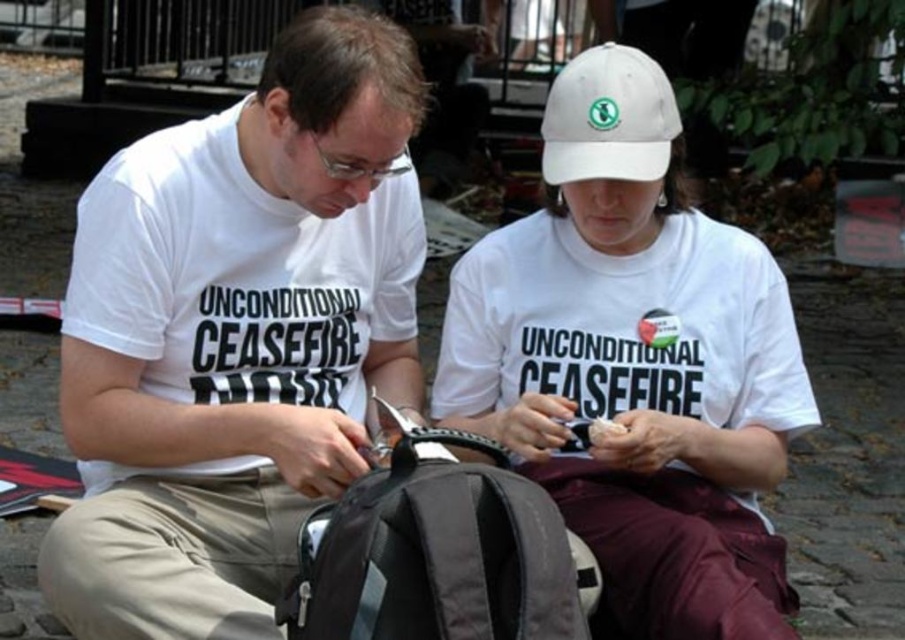
Question: In this image, where is white matte t-shirt at center located relative to white fabric baseball cap at upper center?

Choices:
 (A) left
 (B) right

Answer: (A)

Question: Based on their relative distances, which object is nearer to the khaki cotton pants at lower left?

Choices:
 (A) white fabric baseball cap at upper center
 (B) white matte t-shirt at center

Answer: (B)

Question: Which point is farther to the camera?

Choices:
 (A) white matte t-shirt at center
 (B) white matte cap at upper center

Answer: (A)

Question: Does white matte cap at upper center come behind khaki cotton pants at lower left?

Choices:
 (A) no
 (B) yes

Answer: (A)

Question: Does white matte cap at upper center have a greater width compared to white fabric baseball cap at upper center?

Choices:
 (A) no
 (B) yes

Answer: (B)

Question: Among these points, which one is farthest from the camera?

Choices:
 (A) (742, 440)
 (B) (167, 483)
 (C) (84, 573)
 (D) (591, 49)

Answer: (D)